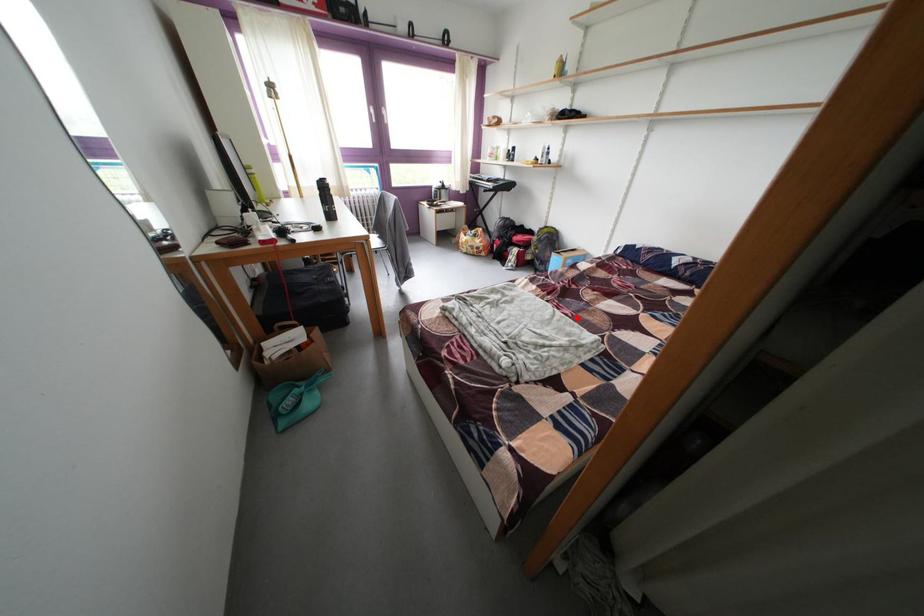
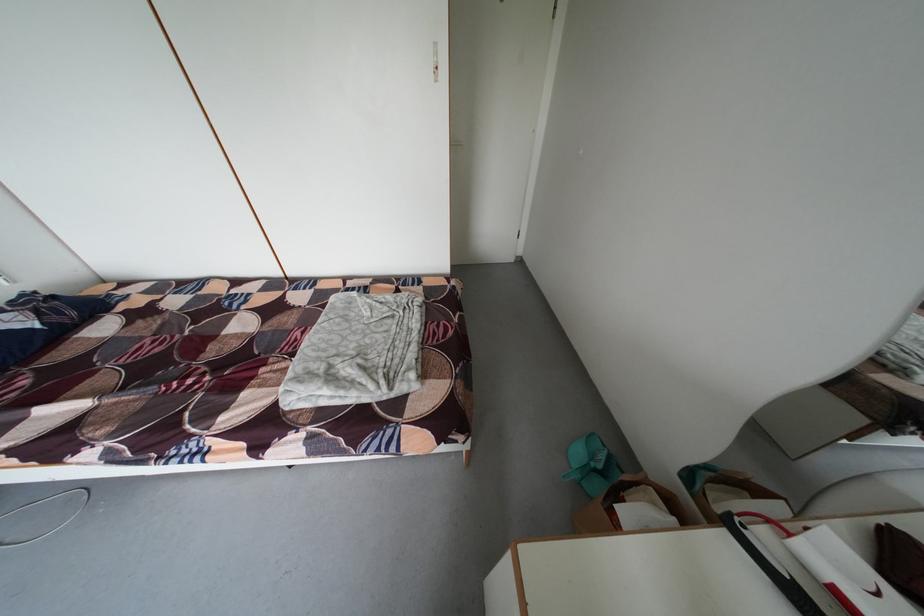
In the second image, find the point that corresponds to the highlighted location in the first image.

(309, 339)